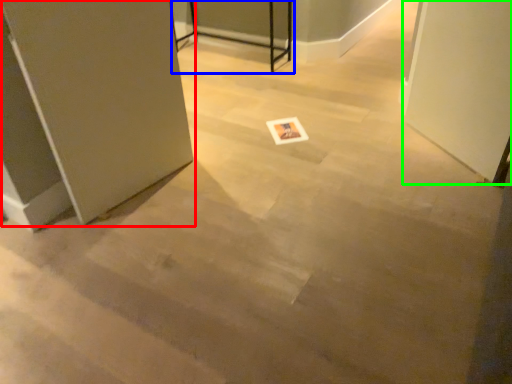
Question: Which object is positioned farthest from door (highlighted by a red box)? Select from table (highlighted by a blue box) and screen door (highlighted by a green box).

Choices:
 (A) table
 (B) screen door

Answer: (A)